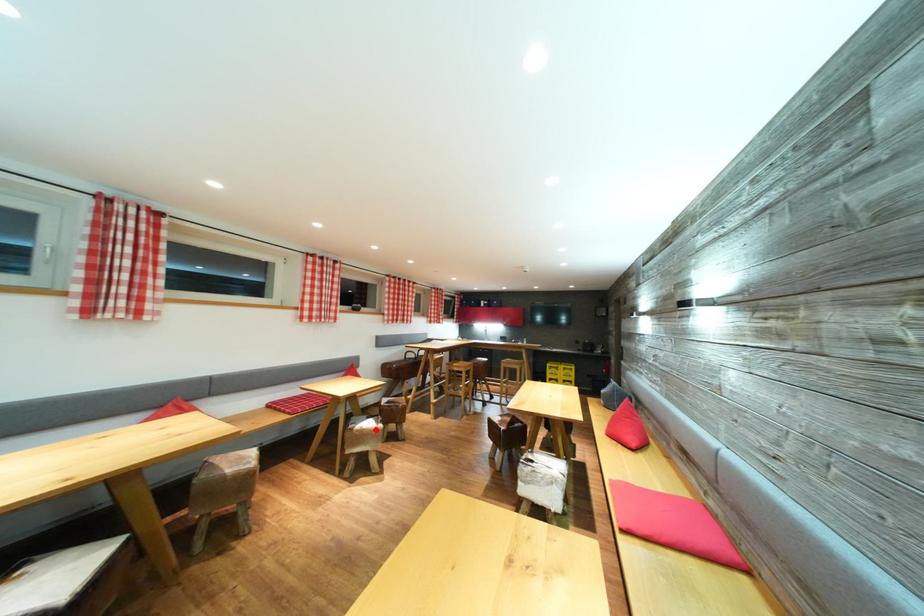
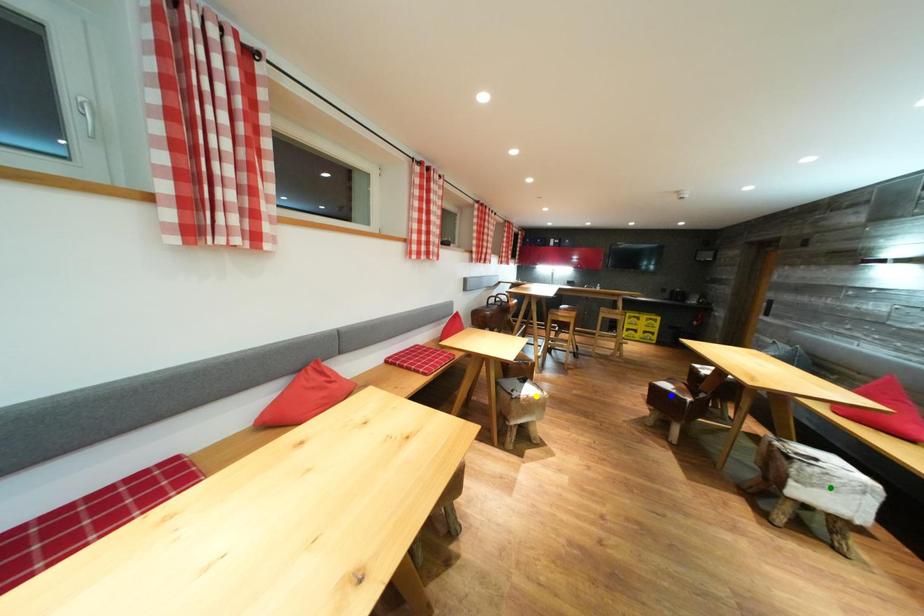
Question: I am providing you with two images of the same scene from different viewpoints. A red point is marked on the first image. You are given multiple points on the second image. Which spot in image 2 lines up with the point in image 1?

Choices:
 (A) blue point
 (B) green point
 (C) yellow point

Answer: (C)